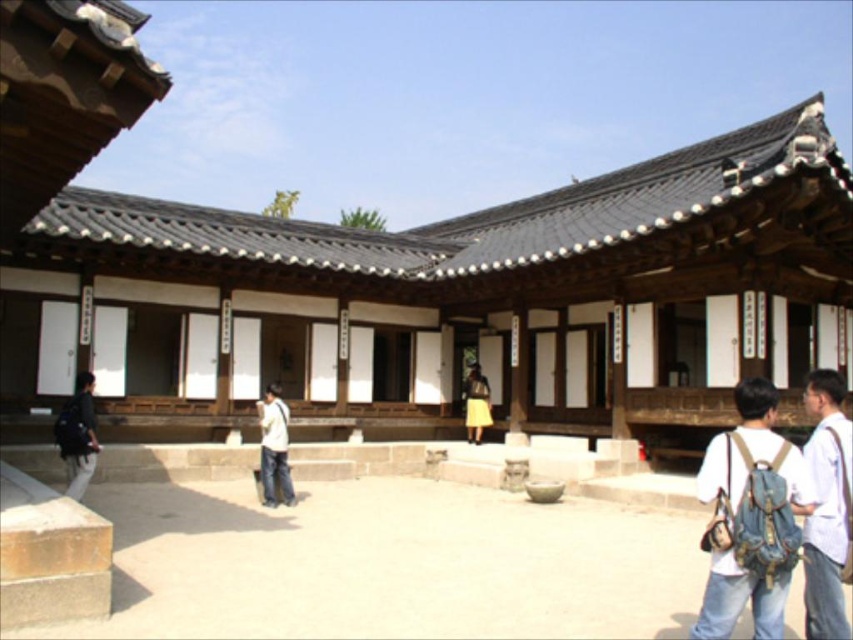
You are standing in the courtyard of the traditional Korean building and want to walk to the entrance of the building. There are two points marked in the scene, point A at coordinates point (76, 436) and point B at coordinates point (271, 472). Which point should you head towards if you want to reach the entrance first?

Point A at coordinates point (76, 436) is in front of point B at coordinates point (271, 472), so you should head towards point A to reach the entrance first.

You are standing in the courtyard of the traditional Korean building and want to place a new bench. The bench requires 1 meter of space. Is there enough space next to the denim backpack at lower right?

The denim backpack at lower right is located at point (770, 520), but without knowing the exact dimensions of the courtyard or the distance between objects, it is impossible to determine if there is enough space for the bench. Please consult a site plan for accurate measurements.